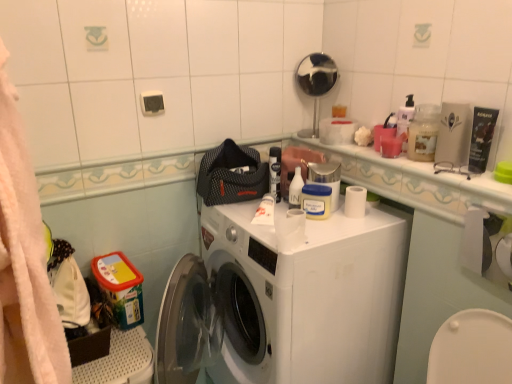
This screenshot has height=384, width=512. I want to click on free space to the right of yellow matte jar at center, the second toiletry viewed from the left, so click(x=362, y=221).